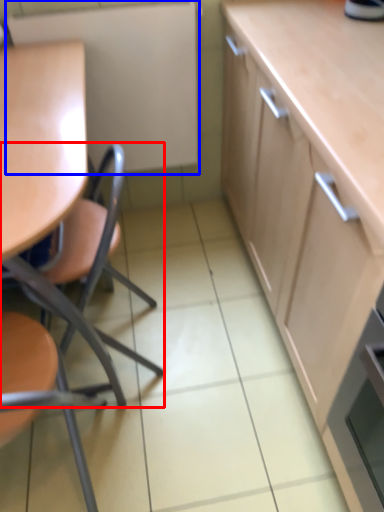
Question: Which object is closer to the camera taking this photo, chair (highlighted by a red box) or appliance (highlighted by a blue box)?

Choices:
 (A) chair
 (B) appliance

Answer: (A)